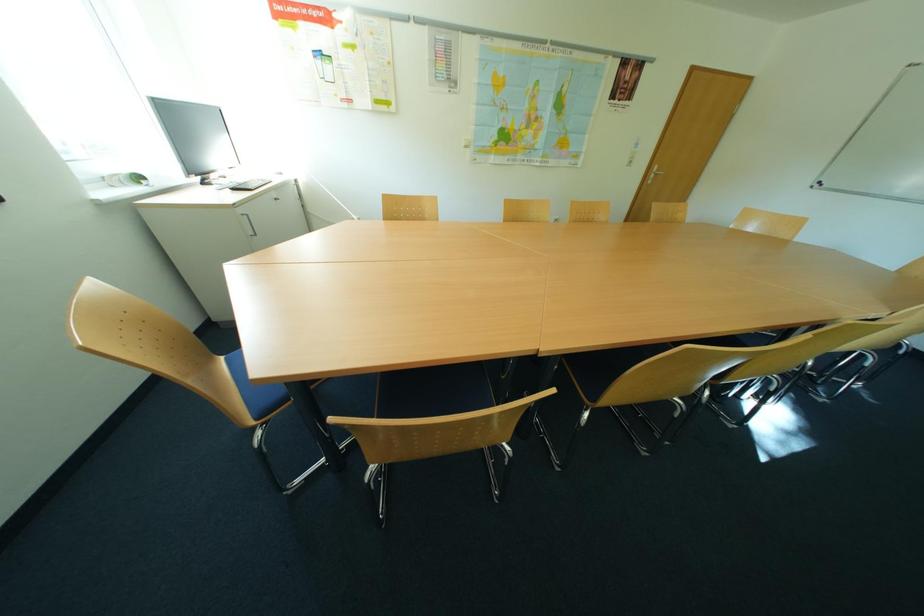
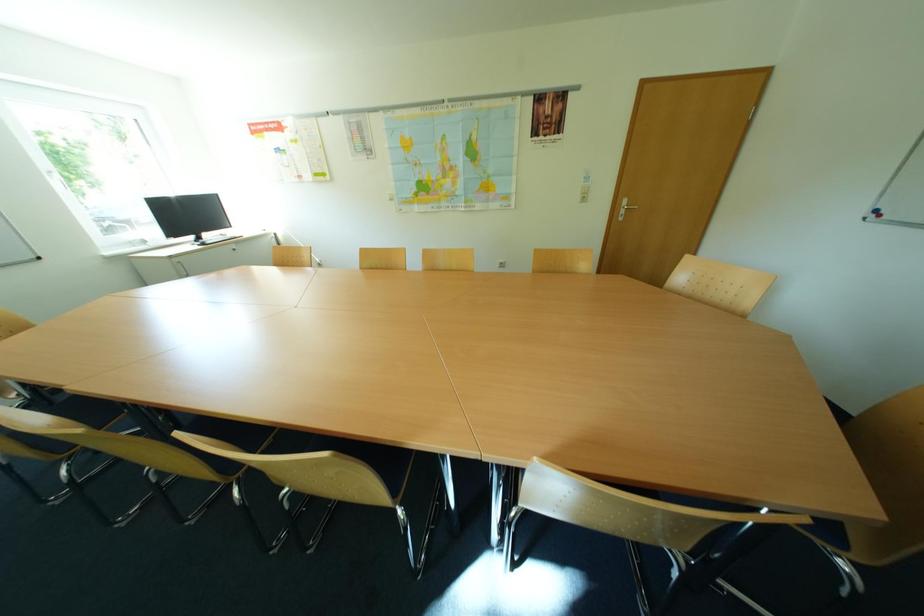
Question: In a continuous first-person perspective shot, in which direction is the camera moving?

Choices:
 (A) Left
 (B) Right
 (C) Forward
 (D) Backward

Answer: (B)